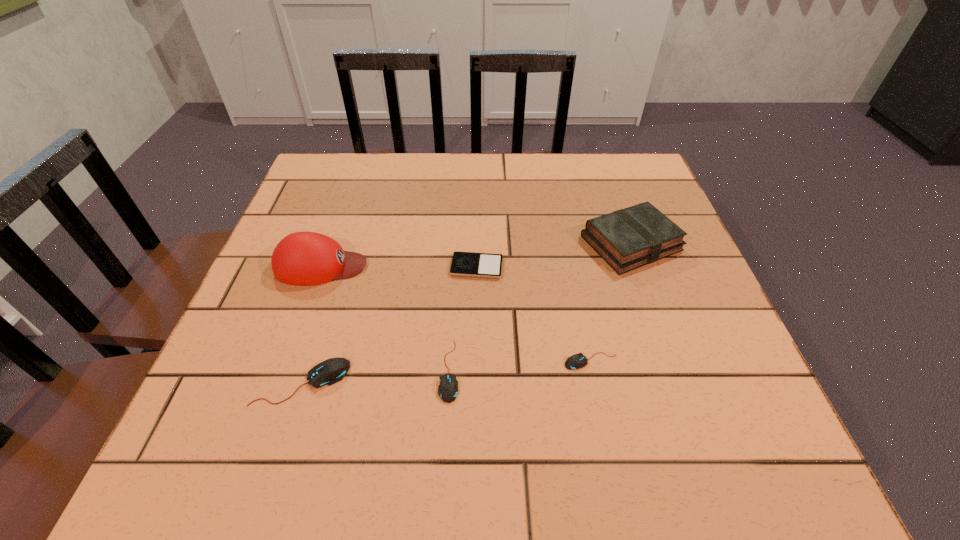
Locate an element on the screen. vacant space located on the right of the fourth tallest object is located at coordinates (623, 371).

This screenshot has height=540, width=960. What are the coordinates of `vacant region located on the left of the second shortest object` in the screenshot? It's located at (342, 361).

The width and height of the screenshot is (960, 540). I want to click on free space located on the back of the book, so click(x=615, y=198).

This screenshot has height=540, width=960. Find the location of `free space located on the front-facing side of the baseball cap`. free space located on the front-facing side of the baseball cap is located at coordinates (509, 266).

Find the location of `vacant space located on the front of the shortest object`. vacant space located on the front of the shortest object is located at coordinates (476, 316).

At what (x,y) coordinates should I click in order to perform the action: click on mouse that is at the left edge. Please return your answer as a coordinate pair (x, y). Looking at the image, I should click on (333, 370).

You are a GUI agent. You are given a task and a screenshot of the screen. Output one action in this format:
    pyautogui.click(x=<x>, y=<y>)
    Task: Click on the baseball cap positioned at the left edge
    
    Given the screenshot: What is the action you would take?
    pyautogui.click(x=304, y=258)

Identify the location of object positioned at the right edge. (629, 238).

You are a GUI agent. You are given a task and a screenshot of the screen. Output one action in this format:
    pyautogui.click(x=<x>, y=<y>)
    Task: Click on the object that is positioned at the near left corner
    
    Given the screenshot: What is the action you would take?
    pyautogui.click(x=333, y=370)

In the image, there is a desktop. Where is `vacant space at the far edge`? This screenshot has width=960, height=540. vacant space at the far edge is located at coordinates (478, 180).